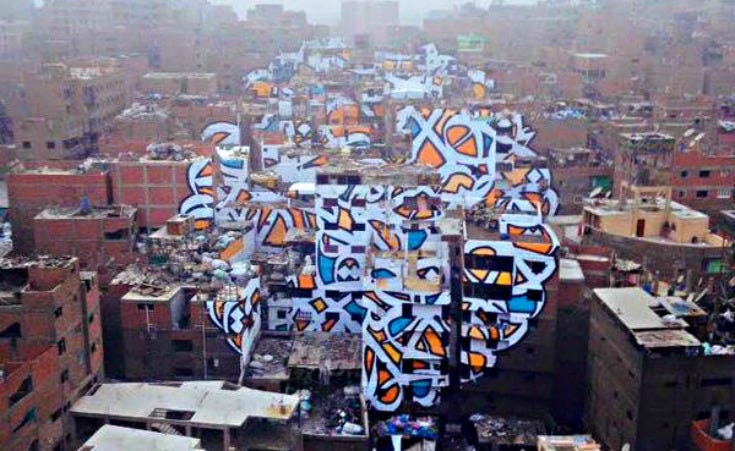
Where is `window`? This screenshot has width=735, height=451. window is located at coordinates (62, 347).